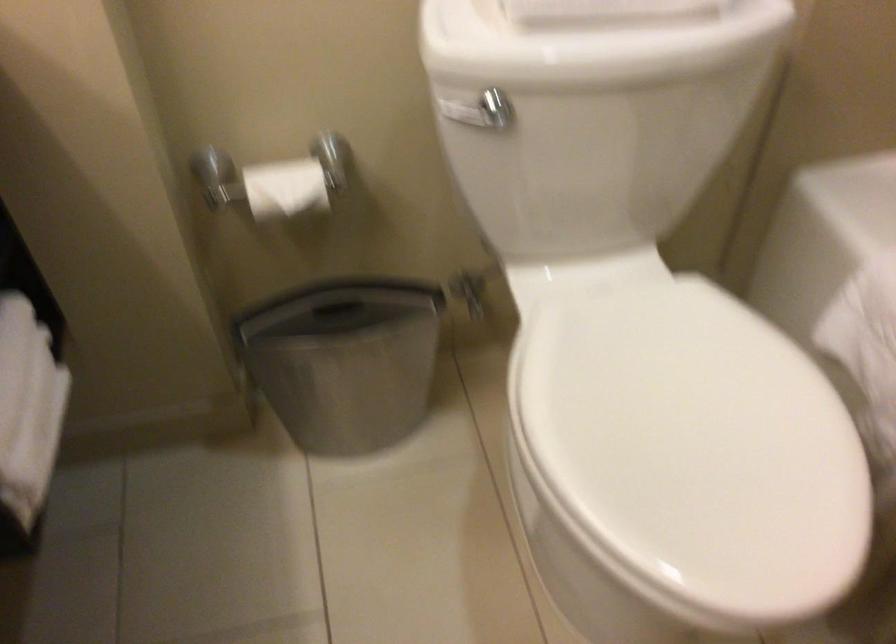
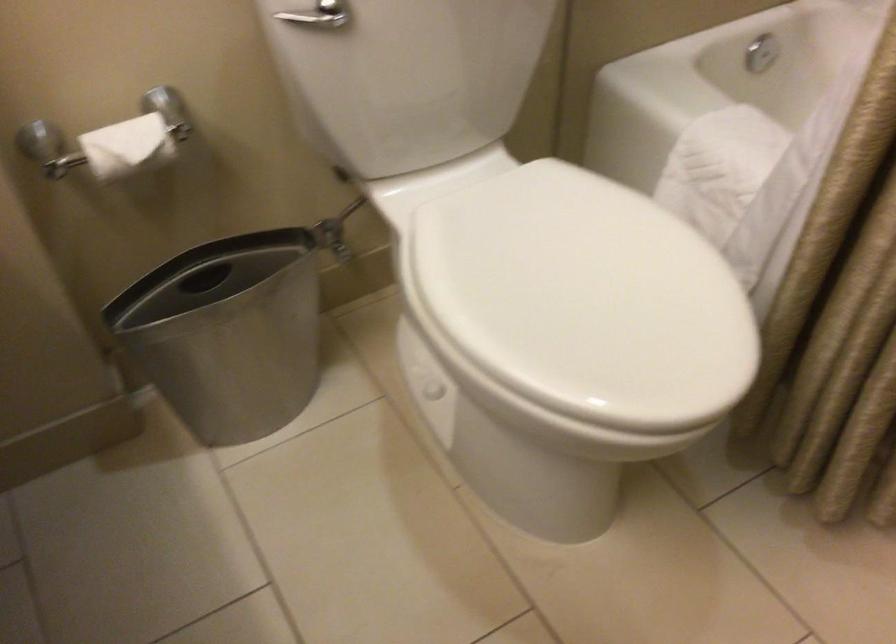
Where in the second image is the point corresponding to [562,173] from the first image?

(407, 77)